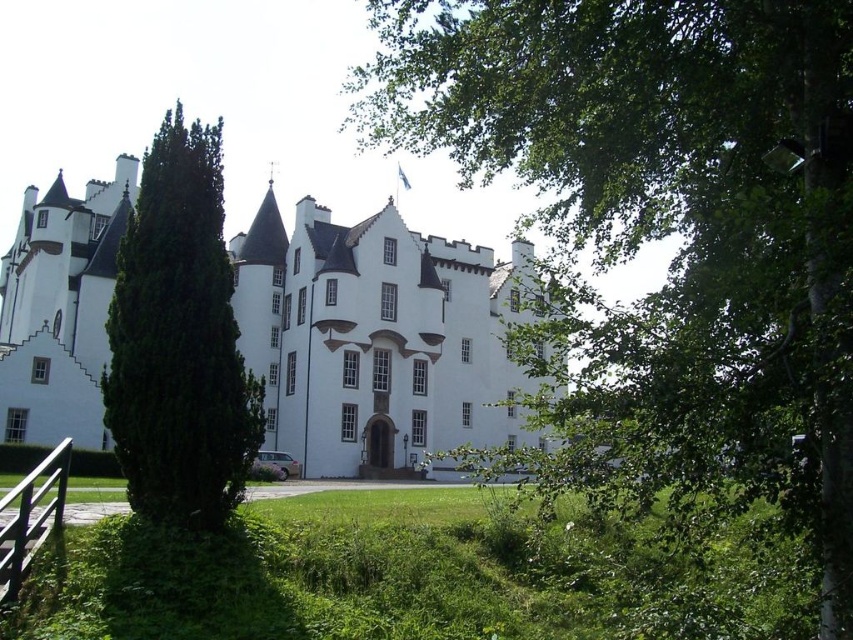
You are standing at the entrance of the white stone castle at center. Looking towards the lawn, which direction would you face?

Since the white stone castle at center is located at point (375, 339), the entrance is likely facing away from the lawn. Therefore, when standing at the entrance and looking towards the lawn, you would be facing north.

You are a visitor approaching the white stone castle at center and notice a green leafy tree at center in the foreground. Which object would appear closer to you as you walk towards the castle?

The green leafy tree at center appears closer because it is positioned in the foreground, whereas the white stone castle at center is the main structure in the background.